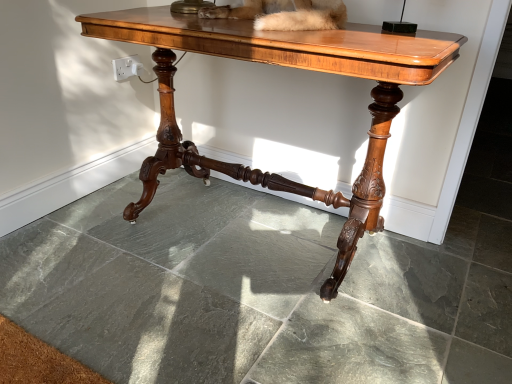
What do you see at coordinates (290, 66) in the screenshot?
I see `shiny wood table at center` at bounding box center [290, 66].

Identify the location of shiny wood table at center. (290, 66).

Where is `shiny wood table at center`? The height and width of the screenshot is (384, 512). shiny wood table at center is located at coordinates (290, 66).